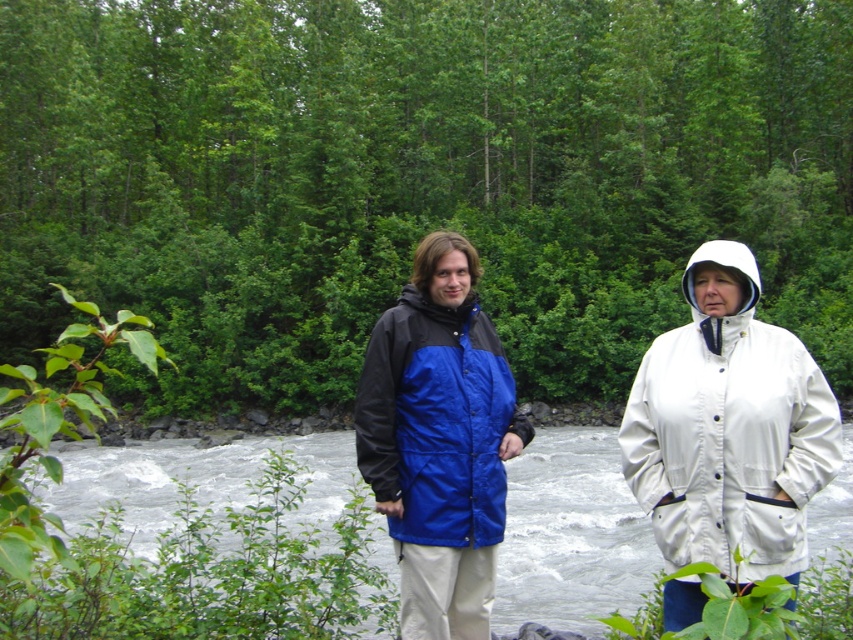
You are planning to cross the river using a small boat. The white water at river center is known to be dangerous. Based on the image, where exactly is the white water located in relation to the river?

The white water at river center is located at point 0.886 on the x axis and 0.261 on the y axis, so the dangerous area is precisely at that coordinate within the river.